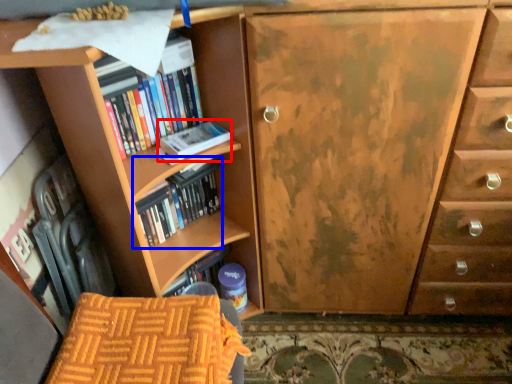
Question: Which point is further to the camera, paperback book (highlighted by a red box) or book (highlighted by a blue box)?

Choices:
 (A) paperback book
 (B) book

Answer: (B)